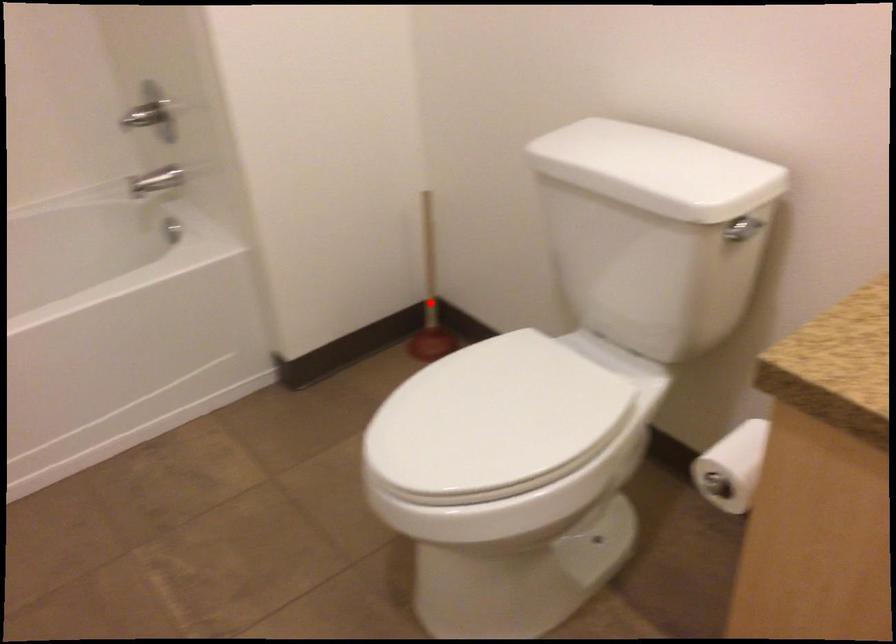
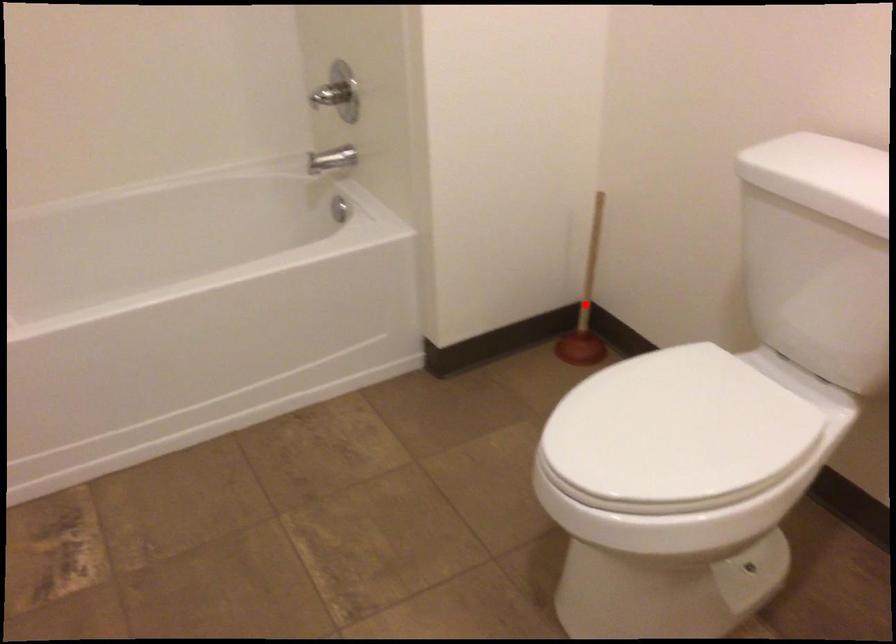
I am providing you with two images of the same scene from different viewpoints. A red point is marked on the first image and another point is marked on the second image. Is the red point in image1 aligned with the point shown in image2?

Yes